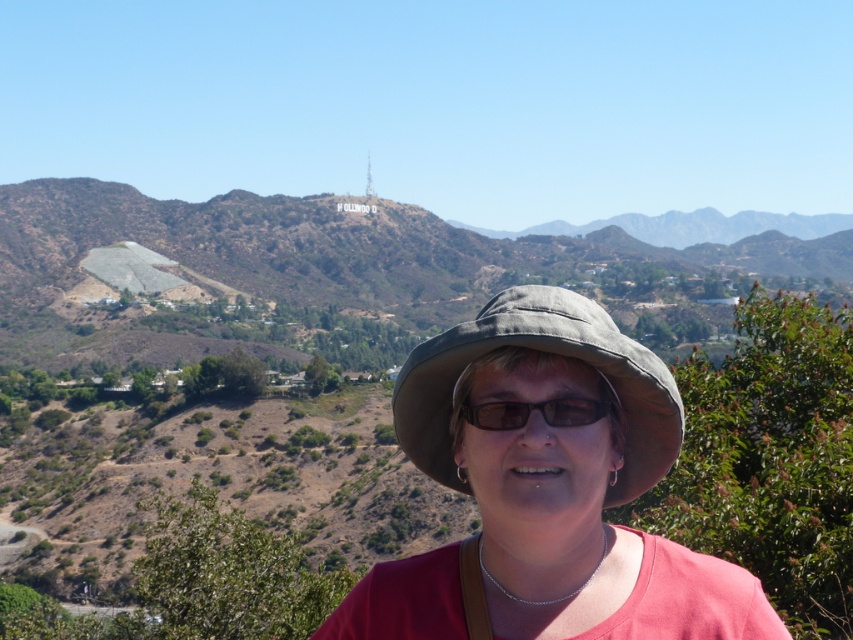
Question: Is green grassy hillside at upper center to the left of matte gray hat at center from the viewer's perspective?

Choices:
 (A) no
 (B) yes

Answer: (A)

Question: Which is farther from the gray fabric hat at center?

Choices:
 (A) green grassy hillside at upper center
 (B) brown matte glasses at center

Answer: (A)

Question: Is green grassy hillside at upper center above matte gray hat at center?

Choices:
 (A) yes
 (B) no

Answer: (A)

Question: Which is farther from the brown matte glasses at center?

Choices:
 (A) matte gray hat at center
 (B) green grassy hillside at upper center

Answer: (B)

Question: Which of the following is the closest to the observer?

Choices:
 (A) brown matte glasses at center
 (B) matte gray hat at center
 (C) green grassy hillside at upper center
 (D) gray fabric hat at center

Answer: (B)

Question: Does green grassy hillside at upper center appear on the right side of matte gray hat at center?

Choices:
 (A) no
 (B) yes

Answer: (B)